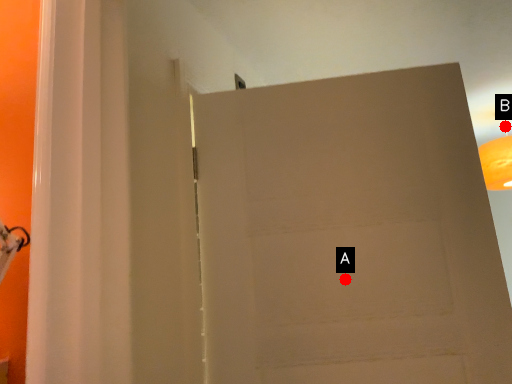
Question: Two points are circled on the image, labeled by A and B beside each circle. Which of the following is the farthest from the observer?

Choices:
 (A) A is further
 (B) B is further

Answer: (B)